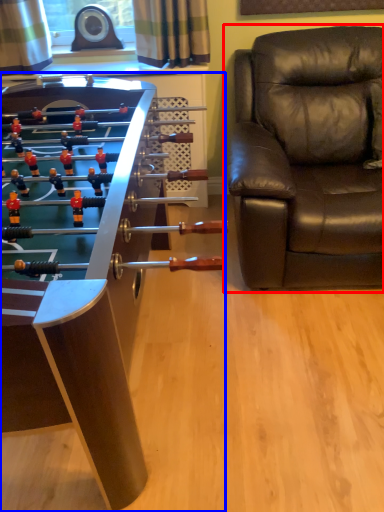
Question: Among these objects, which one is nearest to the camera, chair (highlighted by a red box) or table (highlighted by a blue box)?

Choices:
 (A) chair
 (B) table

Answer: (B)